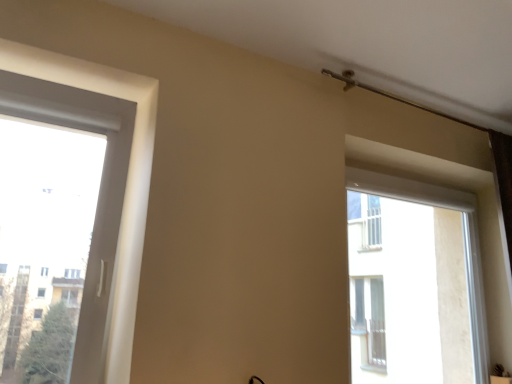
You are a GUI agent. You are given a task and a screenshot of the screen. Output one action in this format:
    pyautogui.click(x=<x>, y=<y>)
    Task: Click on the transparent glass window at upper right
    
    Given the screenshot: What is the action you would take?
    pyautogui.click(x=464, y=238)

Describe the element at coordinates (464, 238) in the screenshot. I see `transparent glass window at upper right` at that location.

This screenshot has height=384, width=512. I want to click on transparent glass window at upper right, so click(x=464, y=238).